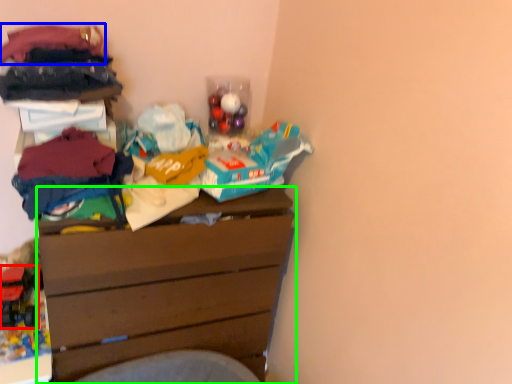
Question: Based on their relative distances, which object is nearer to toy (highlighted by a red box)? Choose from clothing (highlighted by a blue box) and chest of drawers (highlighted by a green box).

Choices:
 (A) clothing
 (B) chest of drawers

Answer: (B)